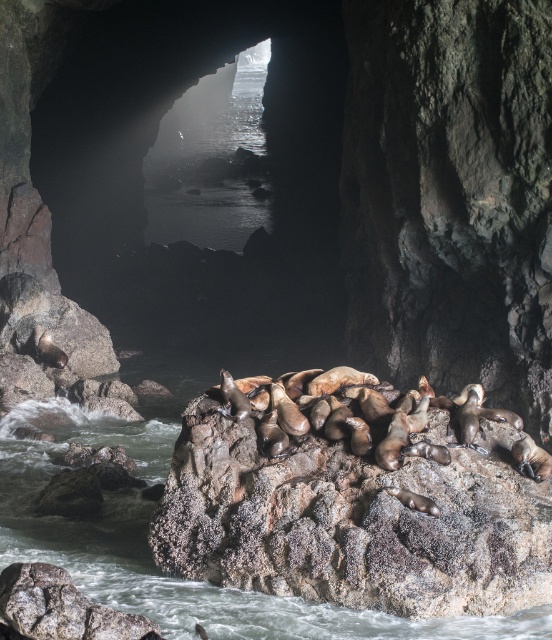
Question: Among these objects, which one is nearest to the camera?

Choices:
 (A) brown rough rock at center
 (B) smooth rock cave at center

Answer: (A)

Question: Does smooth rock cave at center appear on the left side of brown rough rock at center?

Choices:
 (A) no
 (B) yes

Answer: (B)

Question: Observing the image, what is the correct spatial positioning of smooth rock cave at center in reference to brown rough rock at center?

Choices:
 (A) left
 (B) right

Answer: (A)

Question: Is smooth rock cave at center smaller than brown rough rock at center?

Choices:
 (A) yes
 (B) no

Answer: (B)